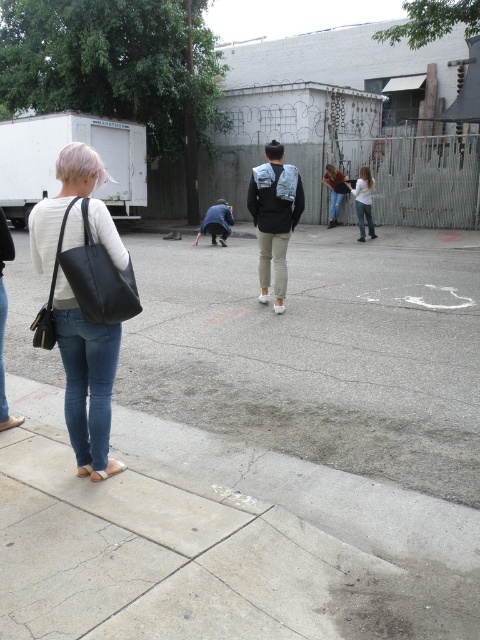
You are standing at the point labeled point (82, 371) and want to walk to the point labeled point (336, 170). Based on the scene description, which direction should you move to get closer to your destination?

To move from point (82, 371) to point (336, 170), you should move upward and to the left since point (336, 170) is further away from the camera compared to point (82, 371), indicating it is located in a more elevated or distant part of the scene.

You are a photographer trying to capture a subject in an urban setting. You notice a person wearing a white matte shirt at center. Based on their position, can you estimate their coordinates in the frame?

The white matte shirt at center is located at coordinates point (363, 200).

You are a pedestrian trying to cross the street and see both the black matte jacket at center and the denim jacket at center. Which one is closer to your left side?

The black matte jacket at center is to the left of the denim jacket at center, so the black matte jacket at center is closer to your left side.